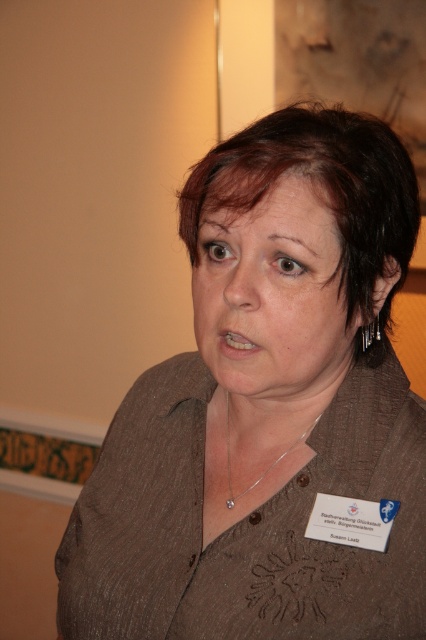
Question: Which is farther from the silver metallic earring at upper right?

Choices:
 (A) brown textured shirt at center
 (B) dark brown hair at center
 (C) matte brown face at center

Answer: (A)

Question: Is brown textured shirt at center above silver metallic earring at upper right?

Choices:
 (A) no
 (B) yes

Answer: (A)

Question: Does brown textured shirt at center come behind matte brown face at center?

Choices:
 (A) no
 (B) yes

Answer: (A)

Question: Is matte brown face at center below dark brown hair at center?

Choices:
 (A) yes
 (B) no

Answer: (A)

Question: Estimate the real-world distances between objects in this image. Which object is closer to the matte brown face at center?

Choices:
 (A) dark brown hair at center
 (B) brown textured shirt at center
 (C) silver metallic necklace at center
 (D) silver metallic earring at upper right

Answer: (A)

Question: Which of the following is the closest to the observer?

Choices:
 (A) (388, 260)
 (B) (106, 612)
 (C) (275, 465)
 (D) (294, 227)

Answer: (D)